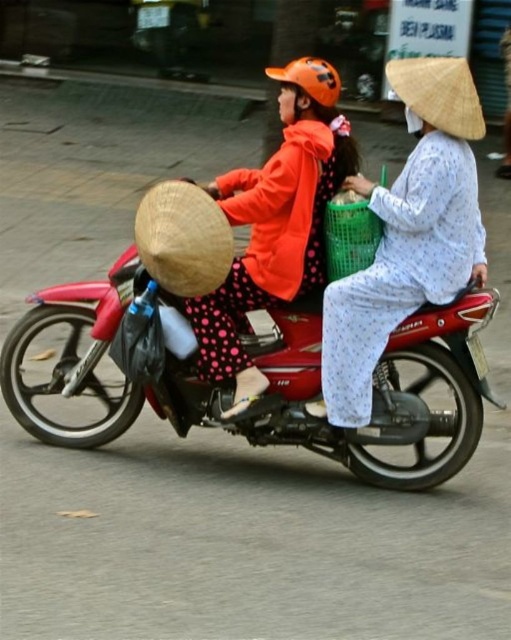
Does natural straw hat at center have a lesser width compared to green woven basket at center?

No.

Which is behind, point (206, 195) or point (360, 237)?

Point (360, 237)

Which is in front, point (137, 230) or point (323, 237)?

Point (137, 230) is in front.

Locate an element on the screen. This screenshot has width=511, height=640. natural straw hat at center is located at coordinates (182, 237).

Can you confirm if red matte motorcycle at center is thinner than green woven basket at center?

No, red matte motorcycle at center is not thinner than green woven basket at center.

Is red matte motorcycle at center closer to camera compared to green woven basket at center?

That is True.

Does point (313, 339) lie in front of point (329, 273)?

No, (313, 339) is behind (329, 273).

At what (x,y) coordinates should I click in order to perform the action: click on red matte motorcycle at center. Please return your answer as a coordinate pair (x, y). Looking at the image, I should click on (247, 353).

Is the position of orange matte helmet at upper center less distant than that of natural straw hat at center?

That is False.

Locate an element on the screen. orange matte helmet at upper center is located at coordinates (275, 221).